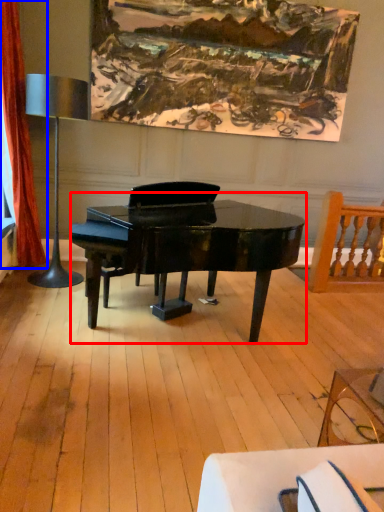
Question: Which object appears farthest to the camera in this image, piano (highlighted by a red box) or curtain (highlighted by a blue box)?

Choices:
 (A) piano
 (B) curtain

Answer: (B)